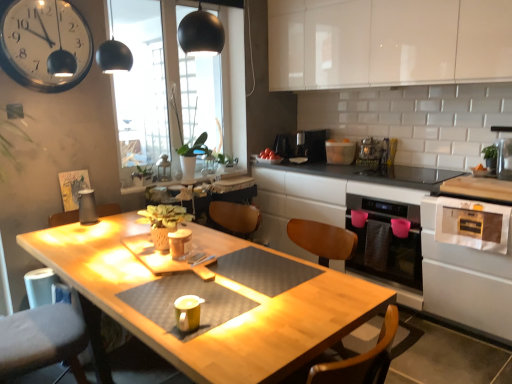
Question: Based on their sizes in the image, would you say white glossy clock at upper left is bigger or smaller than white glossy countertop at center?

Choices:
 (A) big
 (B) small

Answer: (B)

Question: From their relative heights in the image, would you say white glossy clock at upper left is taller or shorter than white glossy countertop at center?

Choices:
 (A) tall
 (B) short

Answer: (B)

Question: Which is nearer to the white glossy clock at upper left?

Choices:
 (A) gray fabric swivel chair at lower left
 (B) green matte plant at center
 (C) transparent glass window at upper center
 (D) black plastic coffee maker at upper center, the fourth appliance when ordered from right to left
 (E) metallic silver toaster at upper right, the second appliance in the right-to-left sequence

Answer: (C)

Question: Which of these objects is positioned closest to the metallic silver toaster at upper right, which ranks as the fourth appliance in back-to-front order?

Choices:
 (A) matte plastic container at center, which ranks as the second appliance in front-to-back order
 (B) matte yellow cup at center, the eighth appliance positioned from the back
 (C) clear glass vase at upper right, the fifth appliance when ordered from back to front
 (D) gray fabric swivel chair at lower left
 (E) white glossy toaster at upper center, arranged as the sixth appliance when viewed from the front

Answer: (E)